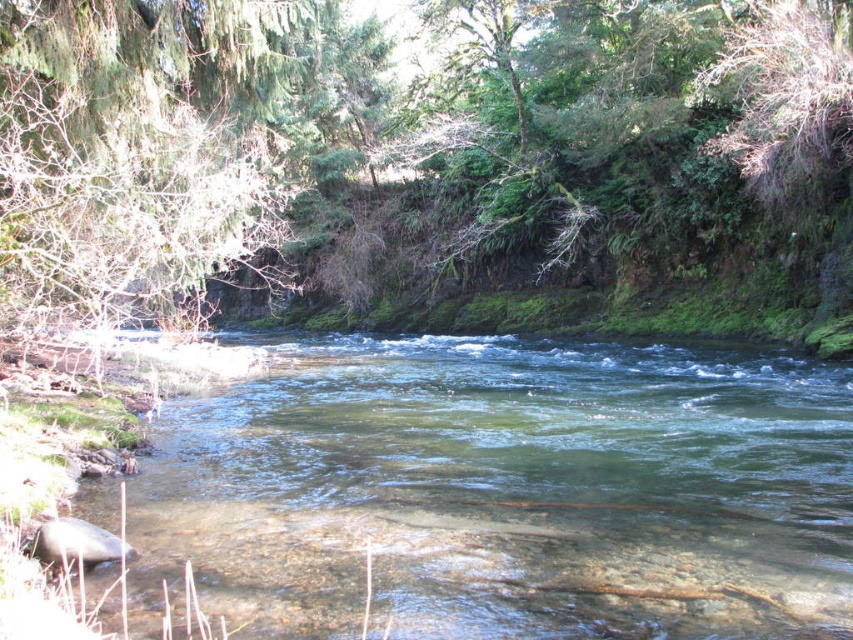
You are a hiker trying to cross the river using a fallen log. You see the green mossy tree at center and the clear water at center. Which object is bigger and would provide a more stable crossing point?

The green mossy tree at center is larger in size than the clear water at center, so it would provide a more stable crossing point.

You are a hiker standing at the edge of the river and see the green mossy tree at center and the clear water at center. Which object is located to the right of the other?

The clear water at center is located to the right of the green mossy tree at center because the green mossy tree at center is positioned on the left side of clear water at center.

You are standing at the point with coordinates point (436, 632) and want to reach the point (675, 285). Which direction should you move to get there?

To reach point (675, 285) from point (436, 632), you should move towards the direction where the point (675, 285) is located, which is behind point (436, 632) according to the spatial arrangement.